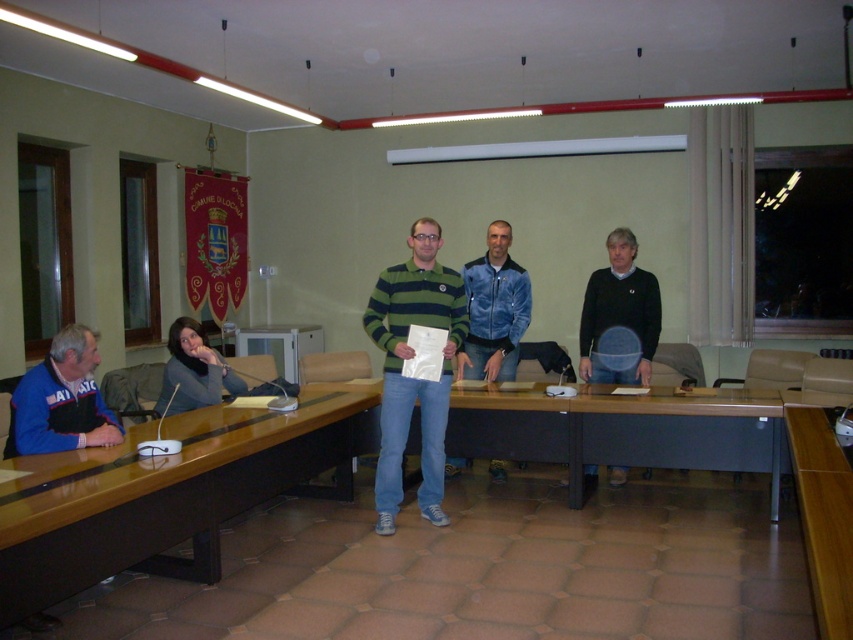
Question: Which object is closer to the camera taking this photo?

Choices:
 (A) blue velour jacket at center
 (B) green striped polo shirt at center

Answer: (B)

Question: Based on their relative distances, which object is nearer to the brown wooden table at lower left?

Choices:
 (A) brown wooden table at lower right
 (B) green striped polo shirt at center

Answer: (B)

Question: Is the position of brown wooden table at lower left more distant than that of black sweater at center?

Choices:
 (A) yes
 (B) no

Answer: (B)

Question: Is green striped polo shirt at center positioned before blue velour jacket at center?

Choices:
 (A) yes
 (B) no

Answer: (A)

Question: Is blue fleece jacket at left positioned in front of matte gray sweater at lower left?

Choices:
 (A) yes
 (B) no

Answer: (A)

Question: Estimate the real-world distances between objects in this image. Which object is farther from the blue velour jacket at center?

Choices:
 (A) green striped polo shirt at center
 (B) blue fleece jacket at left

Answer: (B)